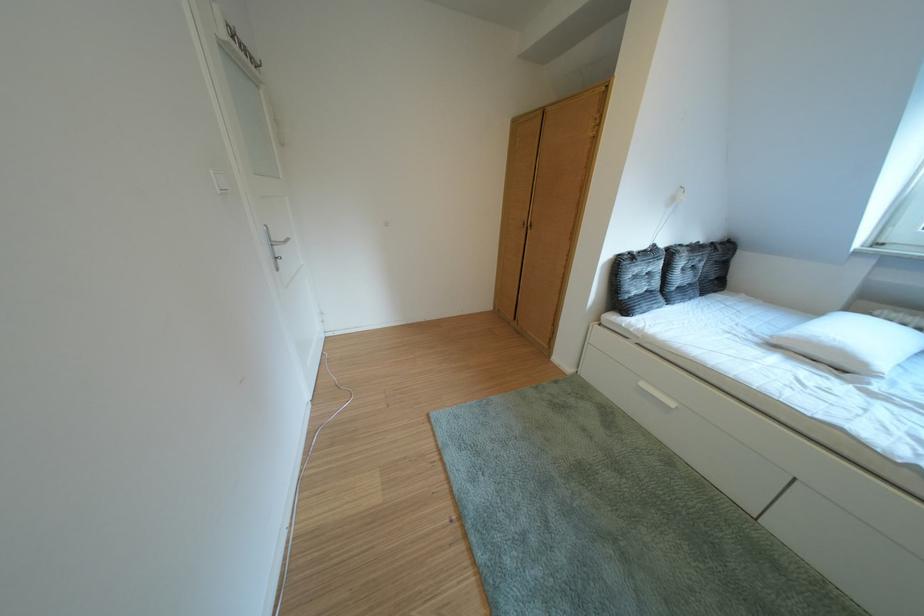
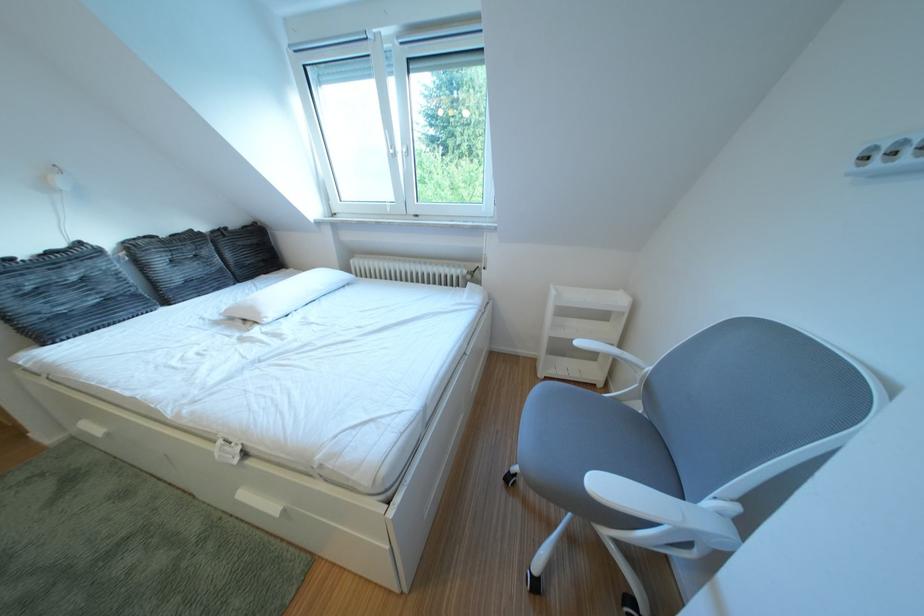
Locate, in the second image, the point that corresponds to [878,369] in the first image.

(273, 318)